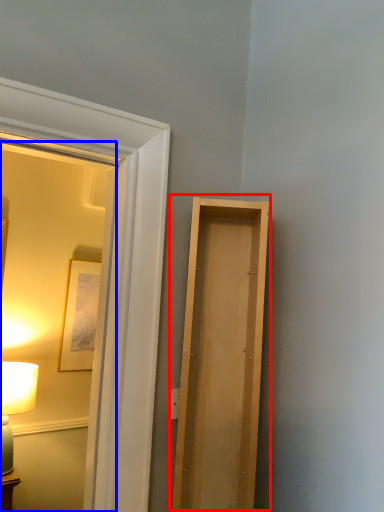
Question: Which point is closer to the camera, door (highlighted by a red box) or mirror (highlighted by a blue box)?

Choices:
 (A) door
 (B) mirror

Answer: (B)